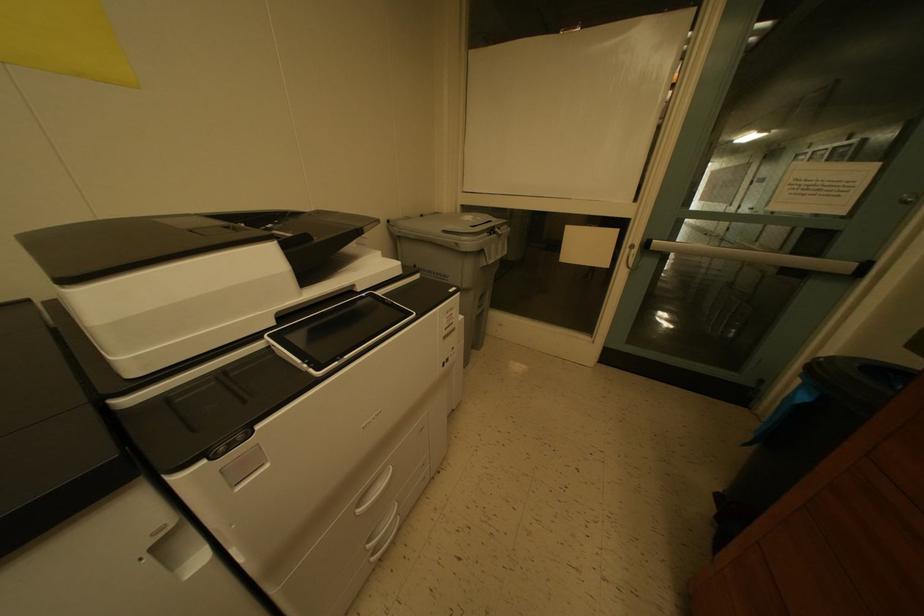
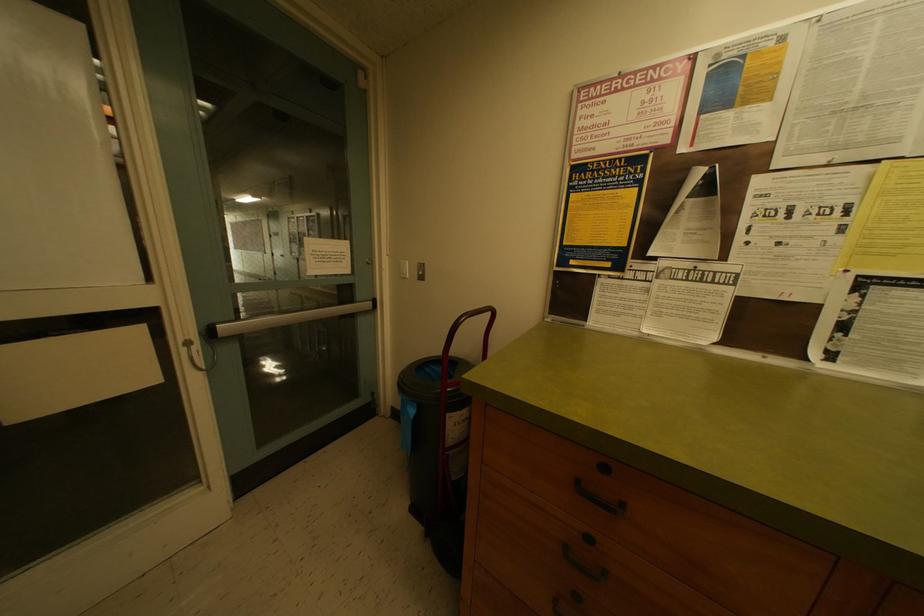
Question: Based on the continuous images, in which direction is the camera rotating? Reply with the corresponding letter.

Choices:
 (A) Left
 (B) Right
 (C) Up
 (D) Down

Answer: (B)